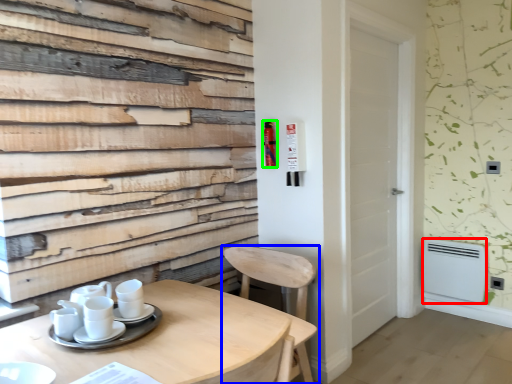
Question: Based on their relative distances, which object is farther from appliance (highlighted by a red box)? Choose from chair (highlighted by a blue box) and extinguisher (highlighted by a green box).

Choices:
 (A) chair
 (B) extinguisher

Answer: (B)